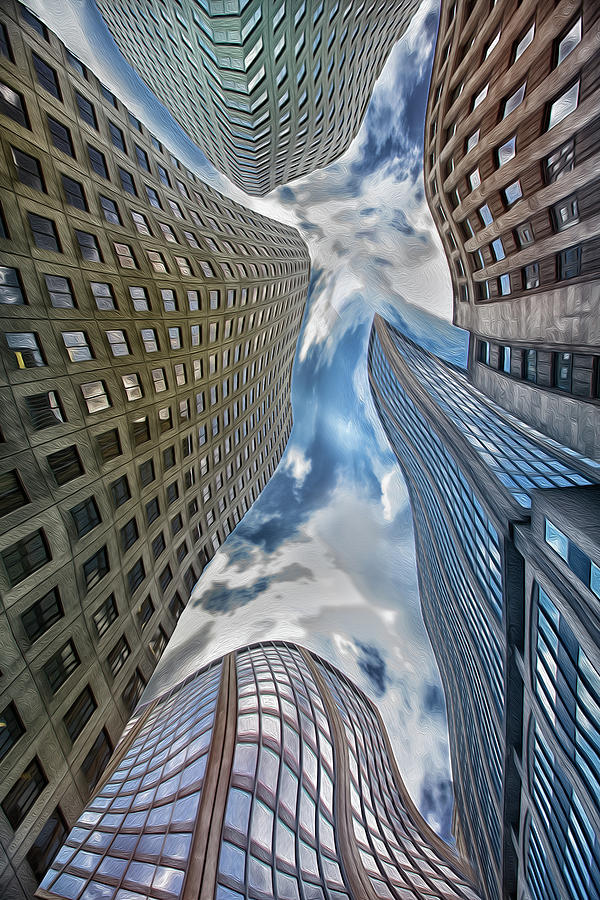
Locate an element on the screen. The image size is (600, 900). second row windows middle section from bottom is located at coordinates (229, 853), (265, 870), (288, 878), (311, 888), (339, 894).